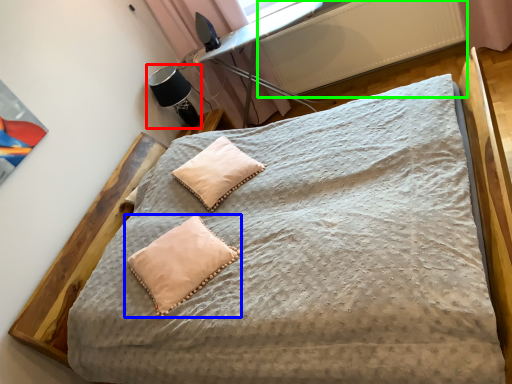
Question: Considering the real-world distances, which object is closest to table lamp (highlighted by a red box)? pillow (highlighted by a blue box) or radiator (highlighted by a green box).

Choices:
 (A) pillow
 (B) radiator

Answer: (B)